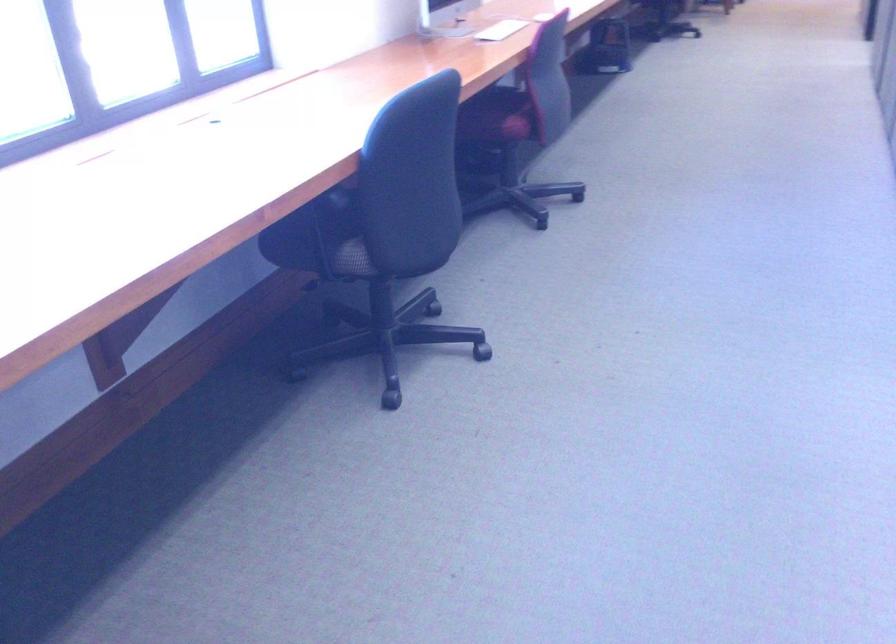
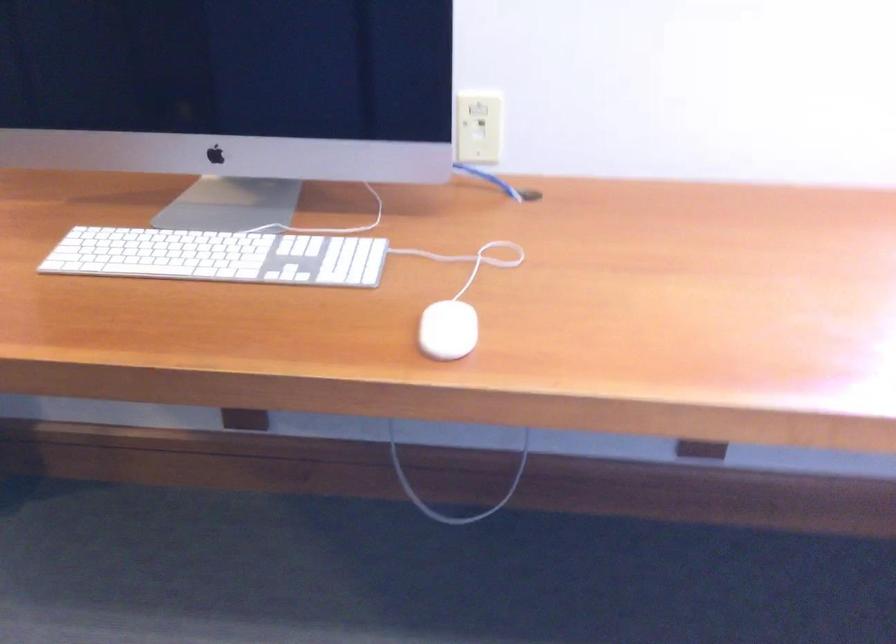
The images are taken continuously from a first-person perspective. In which direction is your viewpoint rotating?

The rotation direction of the camera is left-down.